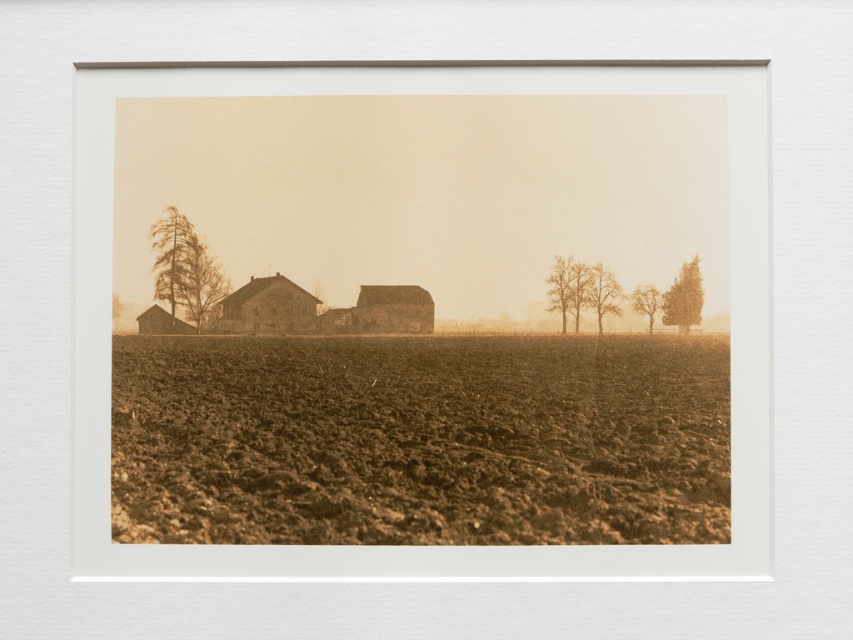
You are an artist sketching this scene. You want to draw the sepia textured tree at left and the brown textured tree at right accurately. Which tree should you draw first to maintain the correct spatial relationship between them?

You should draw the sepia textured tree at left first because the brown textured tree at right is behind it, so drawing the front tree first allows you to layer the background tree appropriately.

You are an artist sketching this scene and want to add a fence between the smooth bark tree at center and the smooth brown tree at right. Based on their positions, where should the fence be placed?

The smooth bark tree at center is located above the smooth brown tree at right, so the fence should be placed below the smooth bark tree at center and above the smooth brown tree at right to separate them appropriately.

You are an artist who wants to place a sepia toned paper at the center of your painting. You have a point at coordinates (421, 323). Is this point suitable for placing the paper?

The point at coordinates (421, 323) is suitable for placing the sepia toned paper at the center as the description states that at this point lies the sepia toned paper at center.